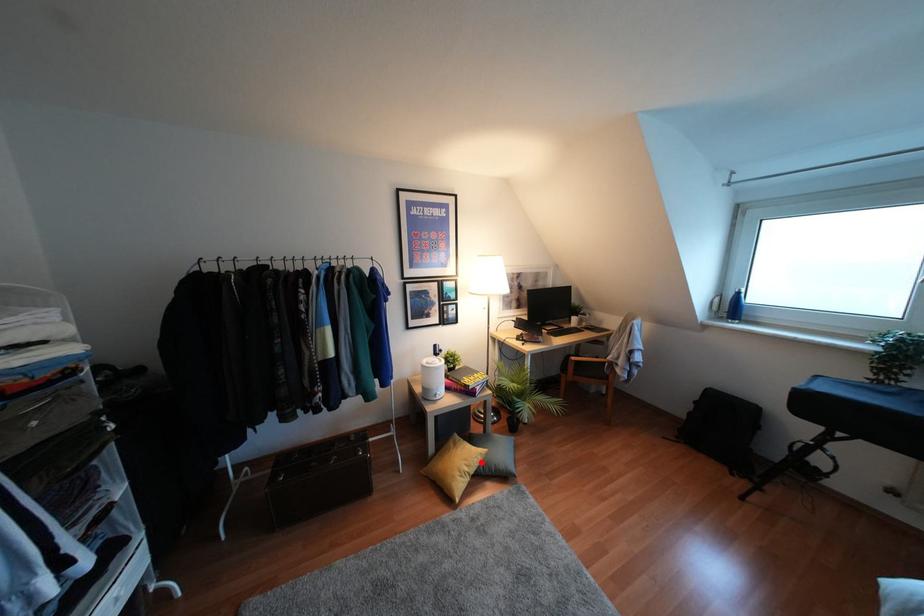
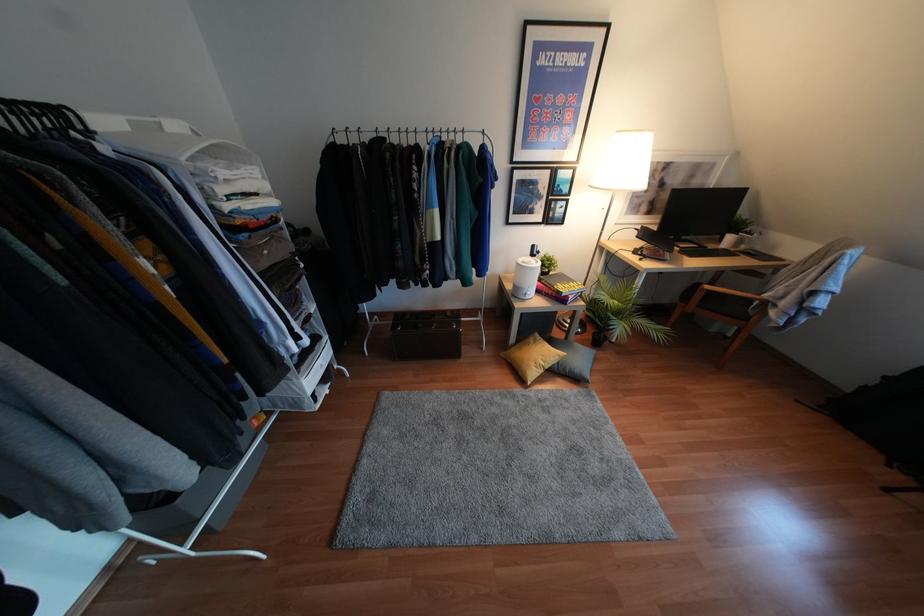
Find the pixel in the second image that matches the highlighted location in the first image.

(556, 362)